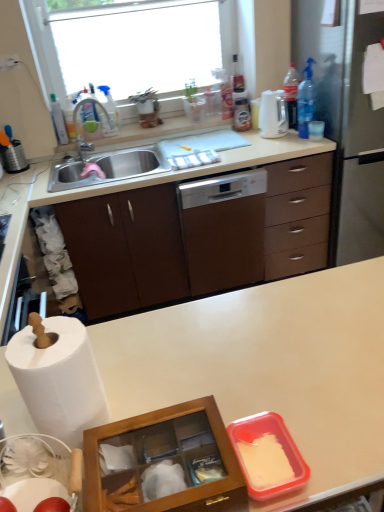
In order to click on vacant area in front of brushed metal grater at left in this screenshot , I will do `click(19, 179)`.